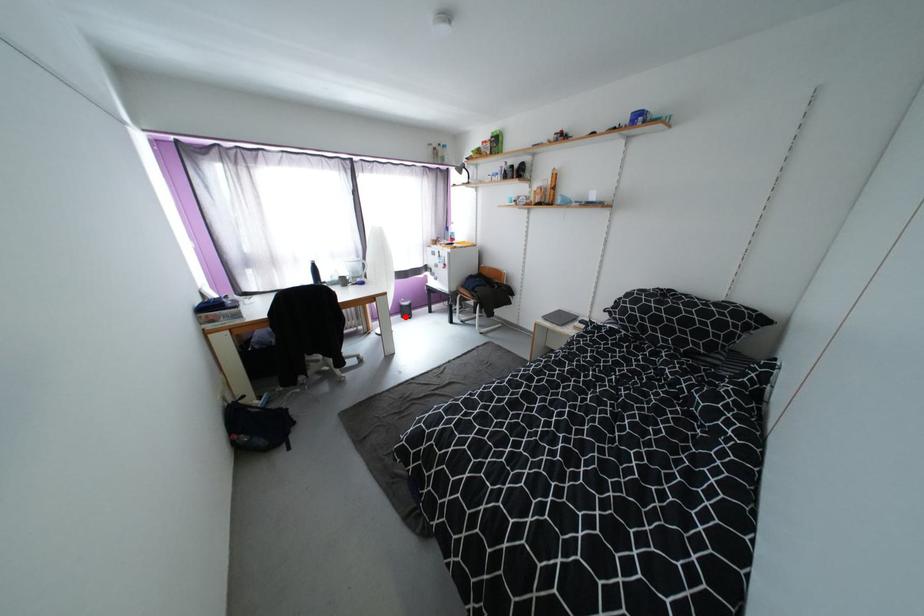
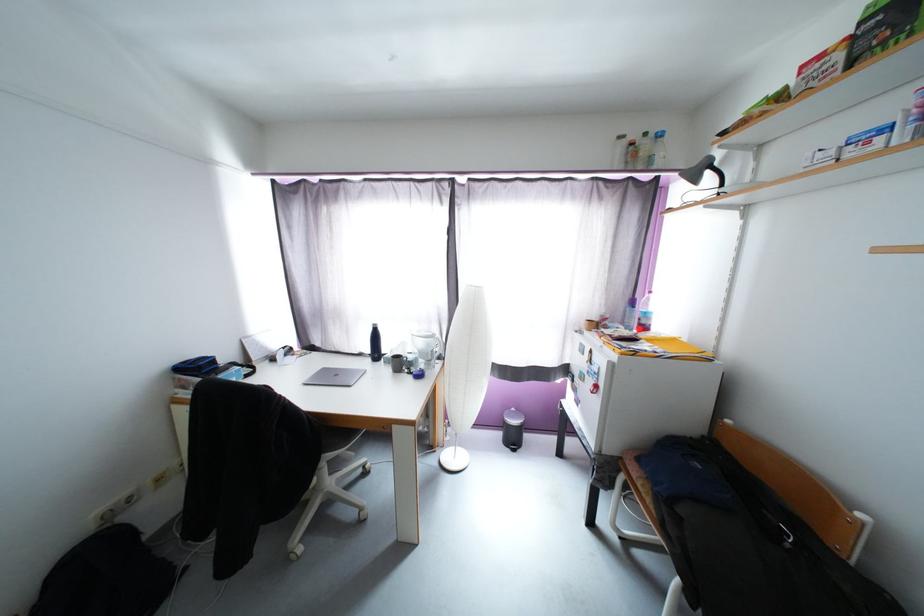
The point at the highlighted location is marked in the first image. Where is the corresponding point in the second image?

(505, 437)